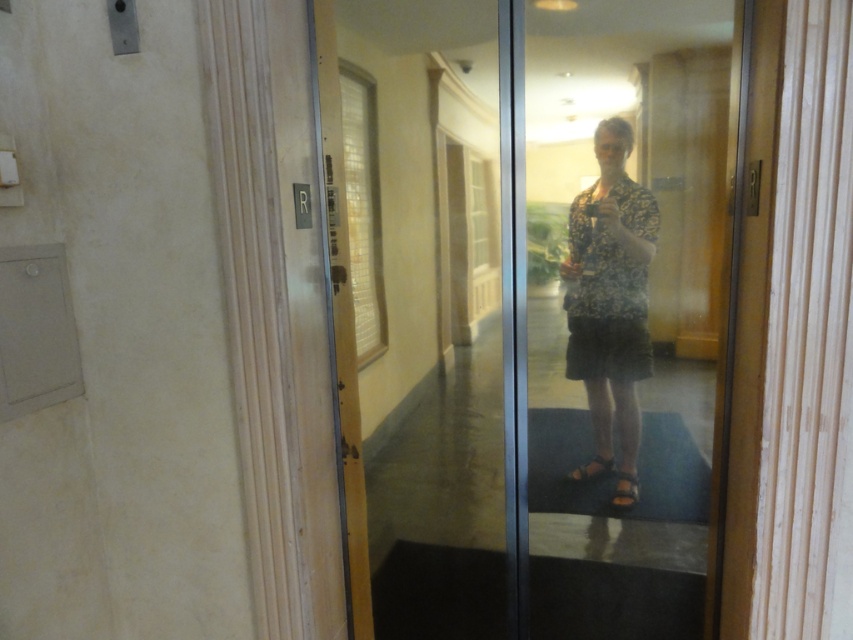
Is transparent glass door at center above floral-patterned shirt at center?

No.

Does transparent glass door at center lie in front of floral-patterned shirt at center?

Yes, transparent glass door at center is in front of floral-patterned shirt at center.

Between point (444, 595) and point (598, 266), which one is positioned in front?

Point (598, 266) is in front.

Image resolution: width=853 pixels, height=640 pixels. In order to click on transparent glass door at center in this screenshot , I will do `click(535, 308)`.